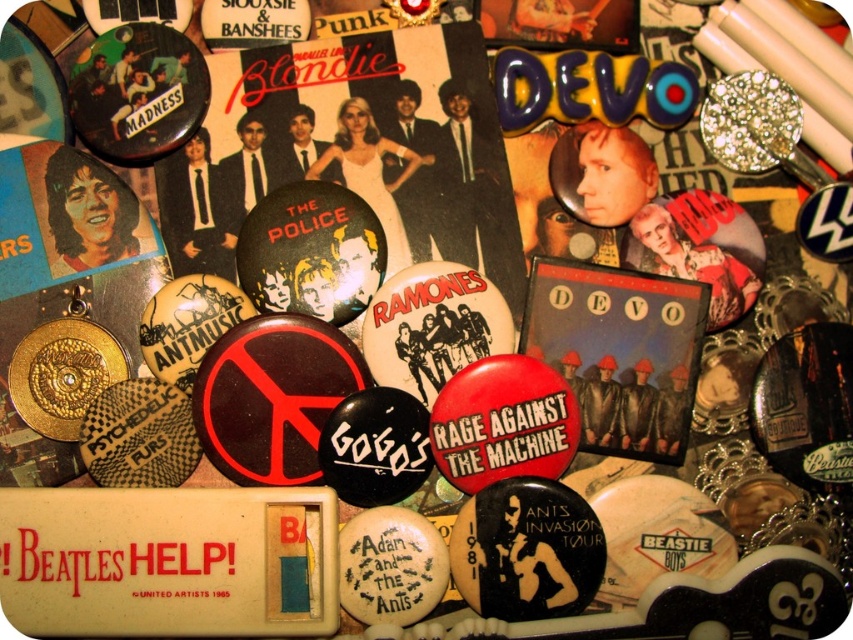
Question: Considering the relative positions of red matte button at center and matte silver pin at upper center in the image provided, where is red matte button at center located with respect to matte silver pin at upper center?

Choices:
 (A) below
 (B) above

Answer: (A)

Question: Which point is farther to the camera?

Choices:
 (A) (569, 3)
 (B) (244, 8)

Answer: (A)

Question: Is red matte button at center positioned behind matte silver pin at upper center?

Choices:
 (A) no
 (B) yes

Answer: (A)

Question: Which object is farther from the camera taking this photo?

Choices:
 (A) matte black button at upper center
 (B) red matte button at center

Answer: (A)

Question: Is the position of red matte button at center more distant than that of matte black button at upper center?

Choices:
 (A) no
 (B) yes

Answer: (A)

Question: Which object is the farthest from the red matte button at center?

Choices:
 (A) matte black button at upper center
 (B) matte silver pin at upper center

Answer: (A)